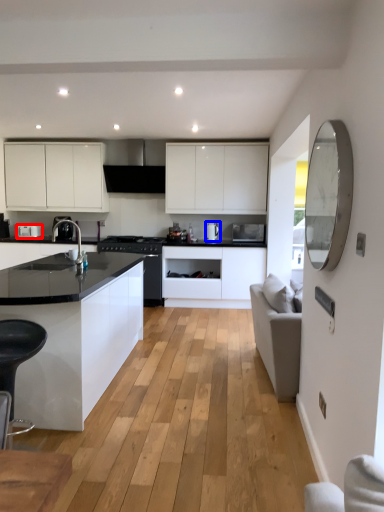
Question: Among these objects, which one is nearest to the camera, kitchen appliance (highlighted by a red box) or kitchen appliance (highlighted by a blue box)?

Choices:
 (A) kitchen appliance
 (B) kitchen appliance

Answer: (B)